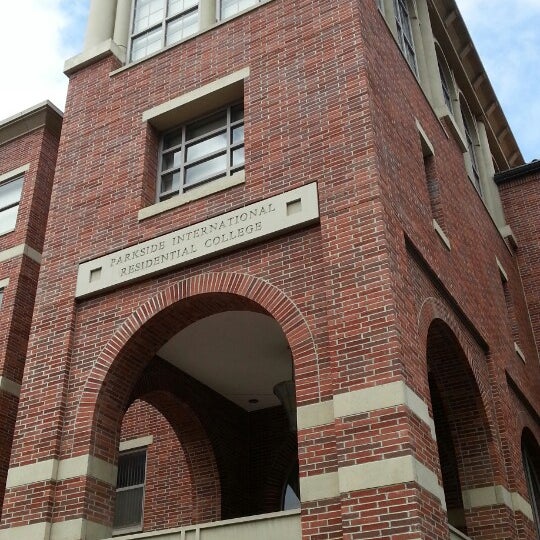
Locate an element on the screen. This screenshot has height=540, width=540. window is located at coordinates (199, 154).